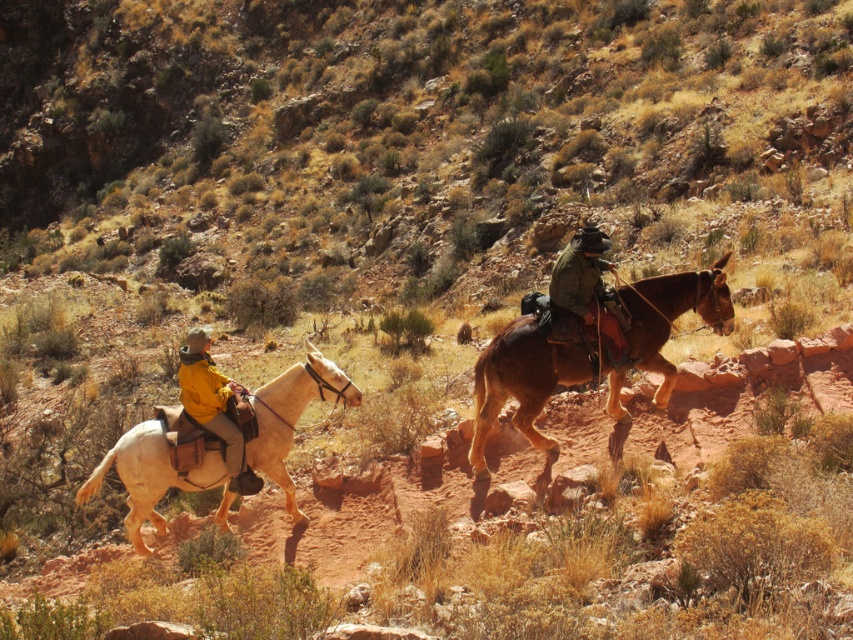
Between brown leather horse at center and white leather horse at left, which one is positioned higher?

brown leather horse at center is higher up.

This screenshot has height=640, width=853. Identify the location of brown leather horse at center. (521, 384).

You are a GUI agent. You are given a task and a screenshot of the screen. Output one action in this format:
    pyautogui.click(x=<x>, y=<y>)
    Task: Click on the brown leather horse at center
    This screenshot has height=640, width=853.
    Given the screenshot: What is the action you would take?
    pyautogui.click(x=521, y=384)

From the picture: Is brown leather horse at center taller than yellow matte jacket at left?

Yes, brown leather horse at center is taller than yellow matte jacket at left.

From the picture: Is brown leather horse at center in front of yellow matte jacket at left?

Yes, brown leather horse at center is closer to the viewer.

Between point (675, 317) and point (241, 449), which one is positioned behind?

The point (675, 317) is behind.

The width and height of the screenshot is (853, 640). Identify the location of brown leather horse at center. (521, 384).

Is white leather horse at left taller than yellow matte jacket at left?

No.

Who is more distant from viewer, [282,468] or [236,438]?

Point [282,468]

The image size is (853, 640). Identify the location of white leather horse at left. (293, 416).